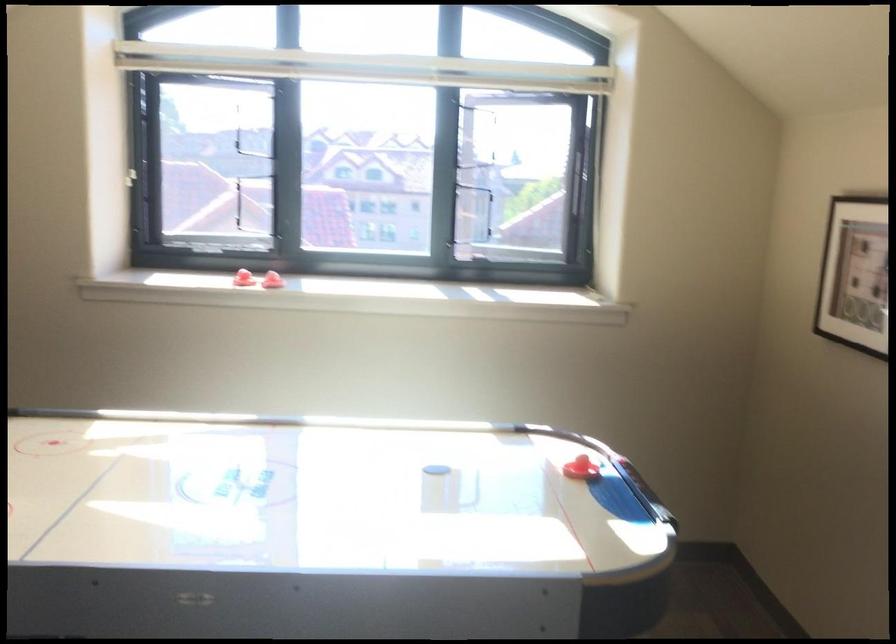
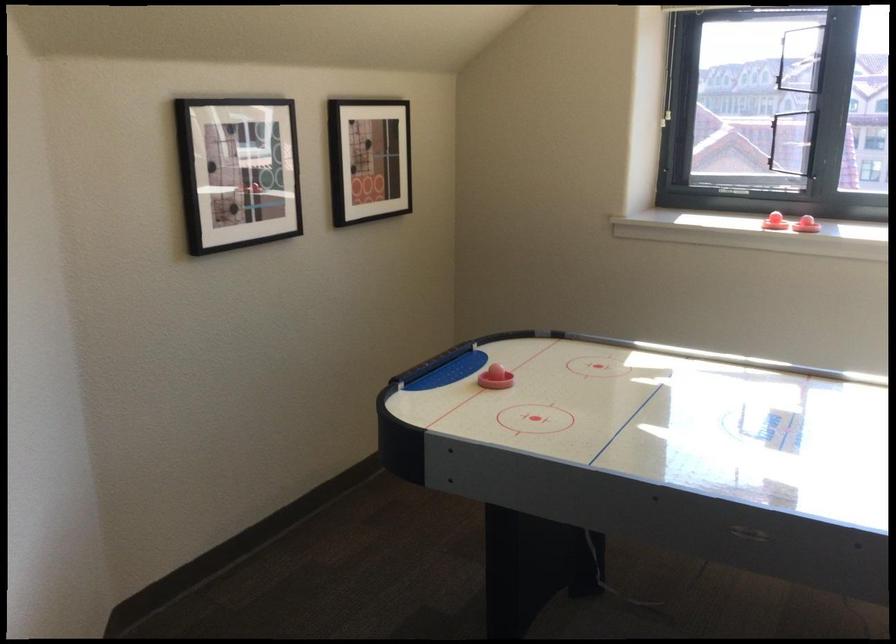
In the second image, find the point that corresponds to [132,187] in the first image.

(669, 120)